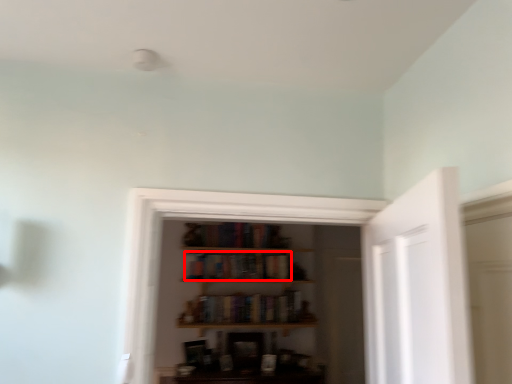
Question: Considering the relative positions of book (annotated by the red box) and book in the image provided, where is book (annotated by the red box) located with respect to the staircase?

Choices:
 (A) right
 (B) left

Answer: (B)